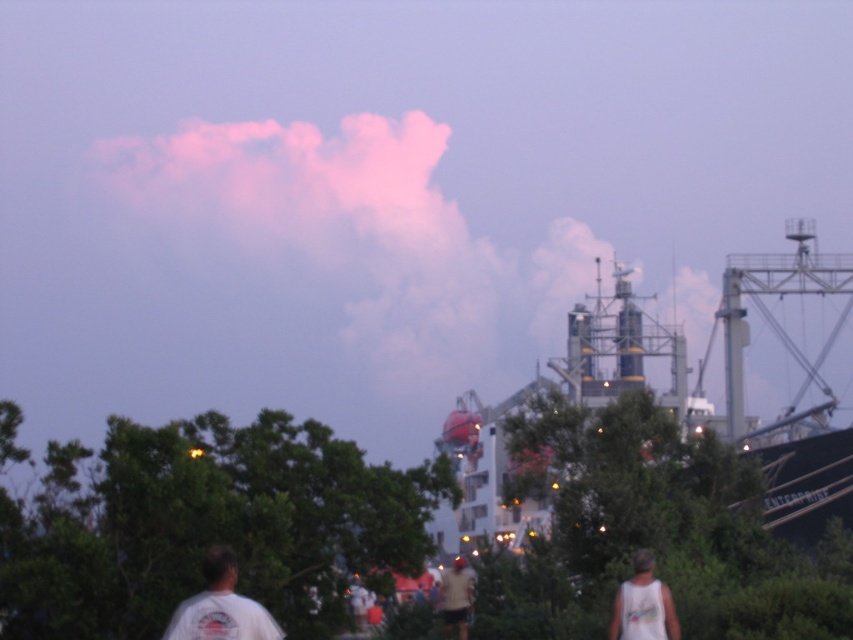
Question: Which point appears closest to the camera in this image?

Choices:
 (A) coord(194,554)
 (B) coord(242,628)
 (C) coord(631,636)
 (D) coord(462,605)

Answer: (B)

Question: Which of the following is the farthest from the observer?

Choices:
 (A) (439, 595)
 (B) (634, 595)
 (C) (212, 612)
 (D) (637, 396)

Answer: (D)

Question: Does white t-shirt at lower left appear on the right side of white tank top at lower right?

Choices:
 (A) yes
 (B) no

Answer: (B)

Question: Is metallic amusement park at lower center wider than white t-shirt at lower left?

Choices:
 (A) no
 (B) yes

Answer: (B)

Question: Among these points, which one is nearest to the camera?

Choices:
 (A) (201, 630)
 (B) (793, 307)
 (C) (461, 589)
 (D) (589, 435)

Answer: (A)

Question: Is metallic gray ship at center-right wider than white t-shirt at lower left?

Choices:
 (A) no
 (B) yes

Answer: (B)